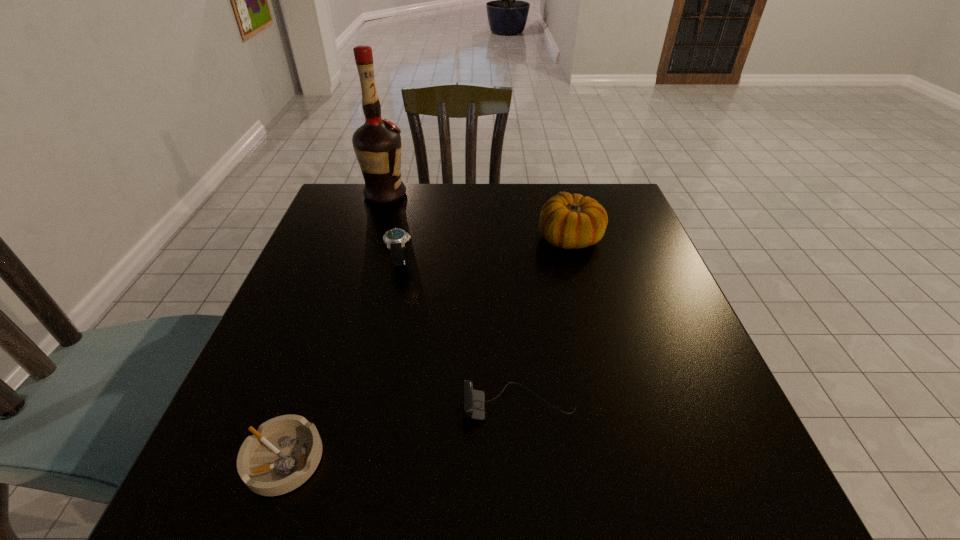
The image size is (960, 540). In order to click on the tallest object in this screenshot , I will do `click(377, 143)`.

Image resolution: width=960 pixels, height=540 pixels. I want to click on the farthest object, so click(377, 143).

Where is `gourd`? gourd is located at coordinates (568, 221).

I want to click on the third tallest object, so click(x=395, y=239).

At what (x,y) coordinates should I click in order to perform the action: click on webcam. Please return your answer as a coordinate pair (x, y). The height and width of the screenshot is (540, 960). Looking at the image, I should click on (473, 401).

Where is `ashtray`? The width and height of the screenshot is (960, 540). ashtray is located at coordinates (284, 452).

Identify the location of vacant space located on the front and back of the tallest object. This screenshot has width=960, height=540. (506, 194).

Locate an element on the screen. This screenshot has width=960, height=540. vacant space located 0.200m on the front of the fourth shortest object is located at coordinates (590, 318).

Find the location of a particular element. The image size is (960, 540). vacant space located 0.050m on the left of the third tallest object is located at coordinates (367, 261).

You are a GUI agent. You are given a task and a screenshot of the screen. Output one action in this format:
    pyautogui.click(x=<x>, y=<y>)
    Task: Click on the free spot located on the front-facing side of the fourth tallest object
    Image resolution: width=960 pixels, height=540 pixels.
    Given the screenshot: What is the action you would take?
    pyautogui.click(x=358, y=404)